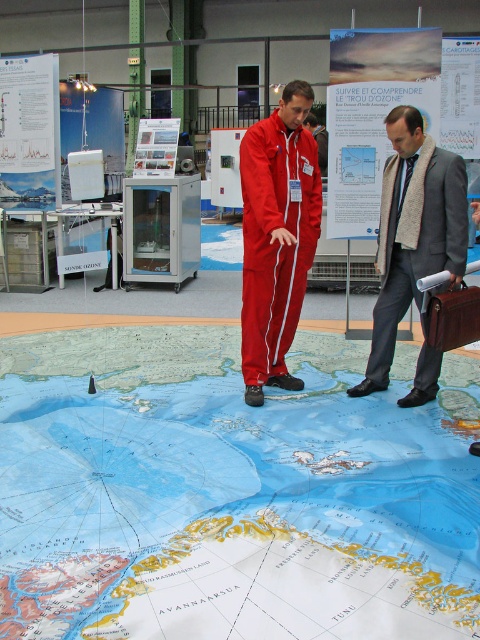
Between matte red jumpsuit at center and brown leather briefcase at lower right, which one has less height?

brown leather briefcase at lower right

Does matte red jumpsuit at center appear on the right side of brown leather briefcase at lower right?

Incorrect, matte red jumpsuit at center is not on the right side of brown leather briefcase at lower right.

Is point (240, 160) closer to camera compared to point (451, 314)?

No, it is not.

In order to click on matte red jumpsuit at center in this screenshot , I will do `click(276, 236)`.

Which is more to the left, blue paper map at center or brown leather briefcase at lower right?

Positioned to the left is blue paper map at center.

Is point (107, 563) positioned before point (430, 310)?

Yes, point (107, 563) is closer to viewer.

The image size is (480, 640). In order to click on blue paper map at center in this screenshot , I will do `click(228, 493)`.

The image size is (480, 640). Identify the location of blue paper map at center. (228, 493).

Which is more to the left, gray wool scarf at right or brown leather briefcase at lower right?

gray wool scarf at right

Where is `gray wool scarf at right`? The image size is (480, 640). gray wool scarf at right is located at coordinates (412, 230).

Locate an element on the screen. The image size is (480, 640). gray wool scarf at right is located at coordinates (412, 230).